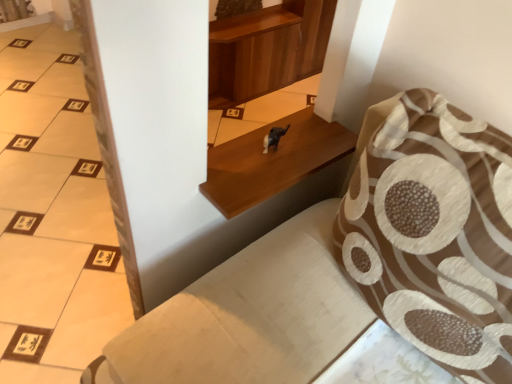
At what (x,y) coordinates should I click in order to perform the action: click on free spot above wooden shelf at center (from a real-world perspective). Please return your answer as a coordinate pair (x, y). The image size is (512, 384). Looking at the image, I should click on (284, 163).